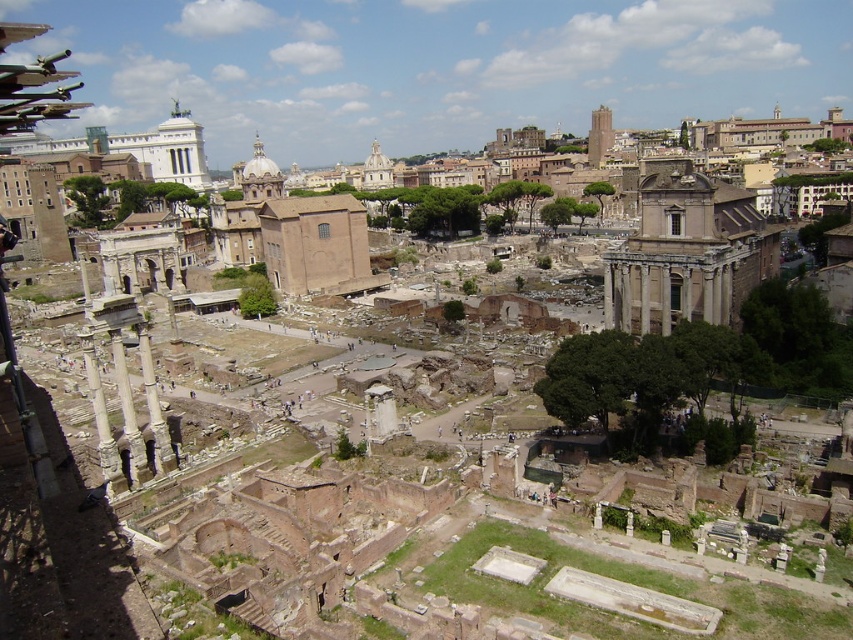
Question: Where is white marble pillar at lower left located in relation to white marble pillar at center in the image?

Choices:
 (A) above
 (B) below

Answer: (A)

Question: Is white marble pillar at lower left closer to the viewer compared to white marble pillar at center?

Choices:
 (A) no
 (B) yes

Answer: (B)

Question: Which point is closer to the camera?

Choices:
 (A) white marble pillar at center
 (B) white marble pillar at lower left
 (C) smooth stone column at center-left
 (D) light brown stone columns at center right

Answer: (B)

Question: Considering the real-world distances, which object is closest to the light brown stone columns at center right?

Choices:
 (A) white marble pillar at lower left
 (B) smooth stone column at center-left

Answer: (B)

Question: Which object is farther from the camera taking this photo?

Choices:
 (A) white marble pillar at center
 (B) smooth stone column at center-left
 (C) light brown stone columns at center right

Answer: (C)

Question: Can you confirm if light brown stone columns at center right is positioned to the left of smooth stone column at center-left?

Choices:
 (A) yes
 (B) no

Answer: (B)